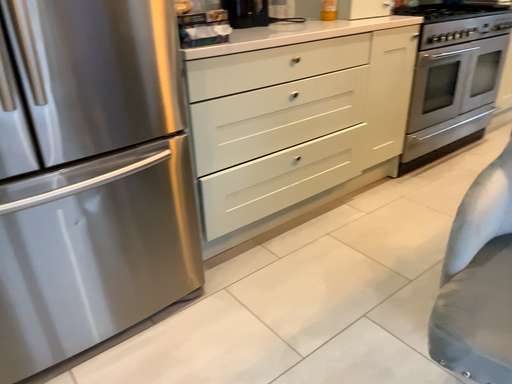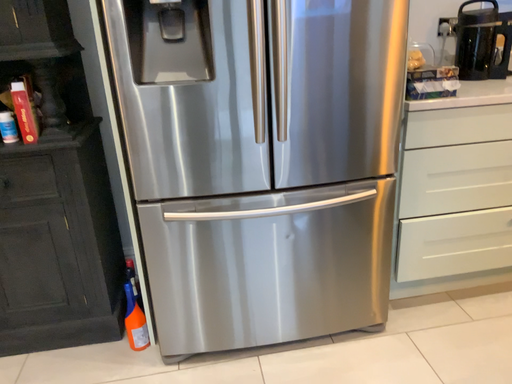
Question: Which way did the camera rotate in the video?

Choices:
 (A) rotated left
 (B) rotated right

Answer: (A)